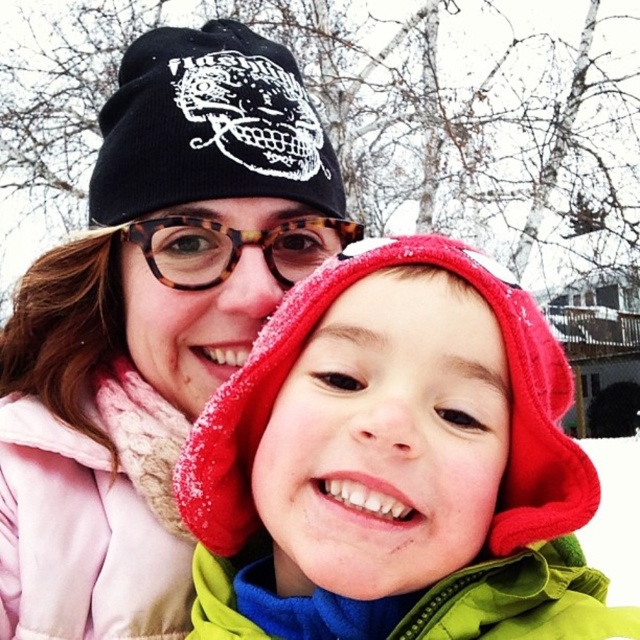
In the scene shown: You are a photographer trying to capture a clear shot of both the fuzzy fleece hood at center and the tortoiseshell glasses at center in the image. Since the camera can only focus on one object at a time, which object should you choose to ensure the other remains in the background?

The fuzzy fleece hood at center is taller than the tortoiseshell glasses at center, so focusing on the fuzzy fleece hood at center will keep the tortoiseshell glasses at center in the background.

You are trying to determine the spatial relationship between the fuzzy fleece hood at center and the tortoiseshell glasses at center in the image. Which one is located higher up?

The tortoiseshell glasses at center are located higher up since the fuzzy fleece hood at center is positioned under them.

You are a photographer trying to capture a clear photo of the fuzzy fleece hood at center. The camera you are using has a minimum focusing distance of 24 inches. Will you be able to take a clear photo without moving the camera closer?

The distance between the fuzzy fleece hood at center and the camera is 25.77 inches, which is slightly beyond the camera minimum focusing distance of 24 inches. Therefore, you can take a clear photo without moving the camera closer.